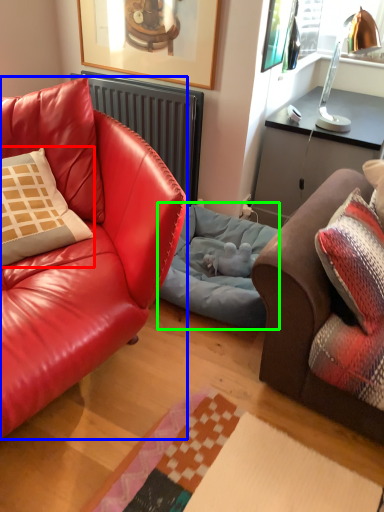
Question: Which object is positioned closest to pillow (highlighted by a red box)? Select from studio couch (highlighted by a blue box) and dog bed (highlighted by a green box).

Choices:
 (A) studio couch
 (B) dog bed

Answer: (A)